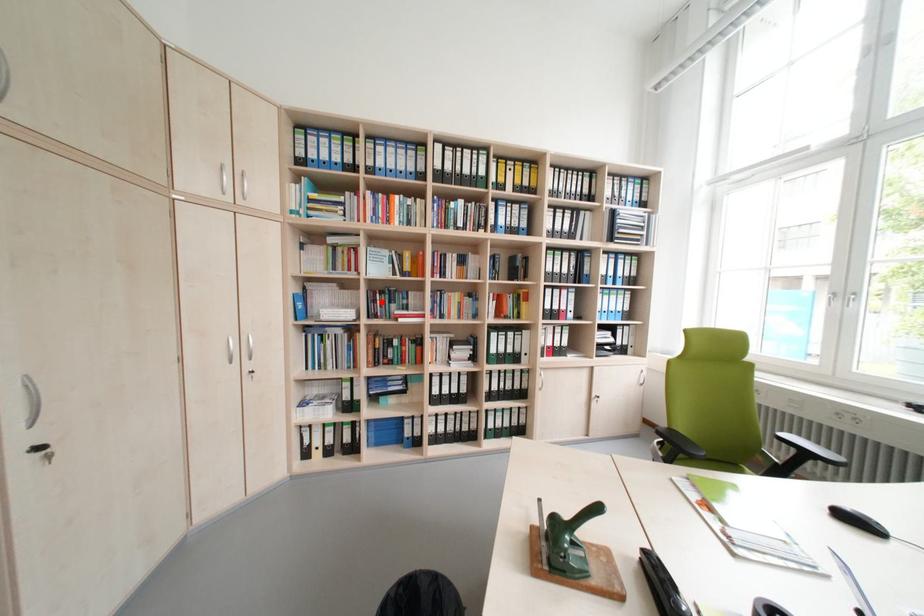
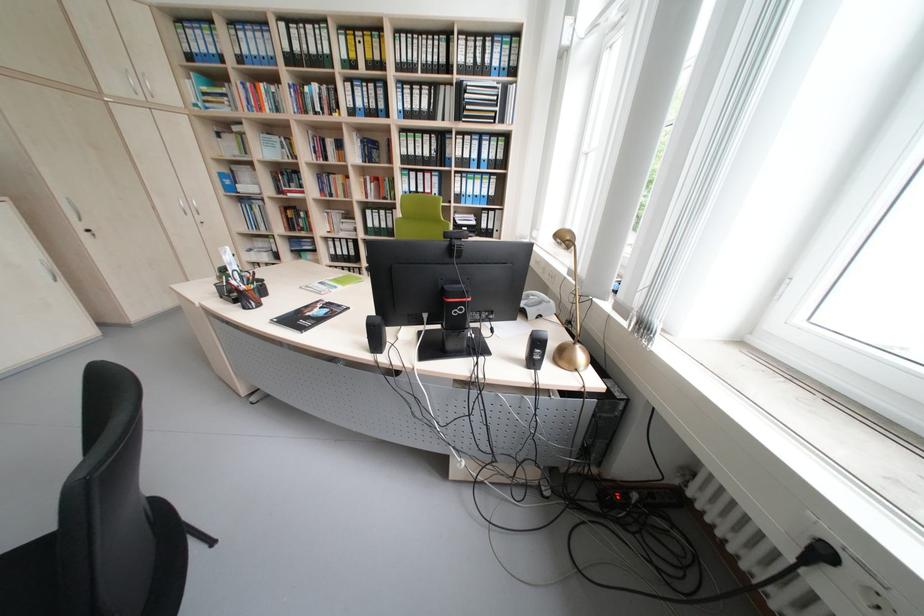
Question: I am providing you with two images of the same scene from different viewpoints. Image1 has a red point marked. In image2, the corresponding 3D location appears at what relative position? Reply with the corresponding letter.

Choices:
 (A) Closer
 (B) Farther

Answer: (A)